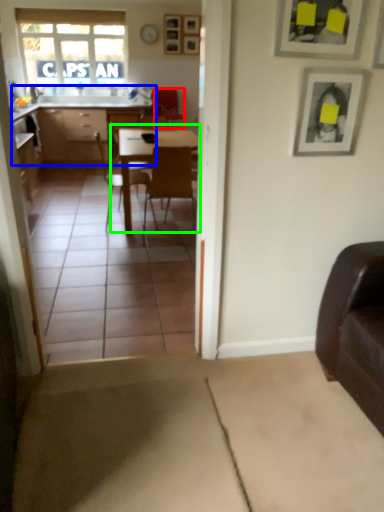
Question: Which object is the farthest from armchair (highlighted by a red box)? Choose among these: cabinetry (highlighted by a blue box) or table (highlighted by a green box).

Choices:
 (A) cabinetry
 (B) table

Answer: (B)